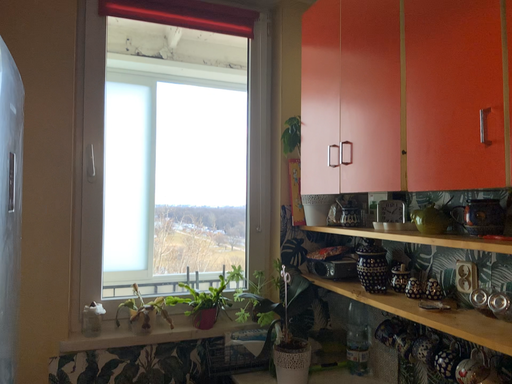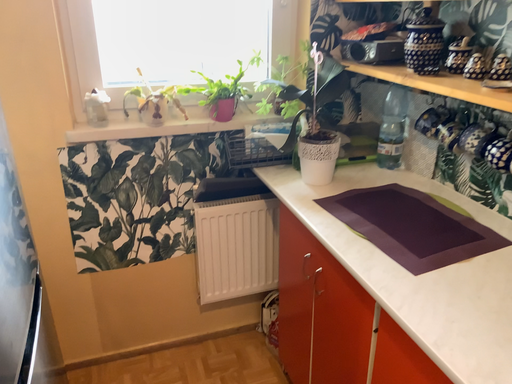
Question: How did the camera likely rotate when shooting the video?

Choices:
 (A) rotated upward
 (B) rotated downward

Answer: (B)